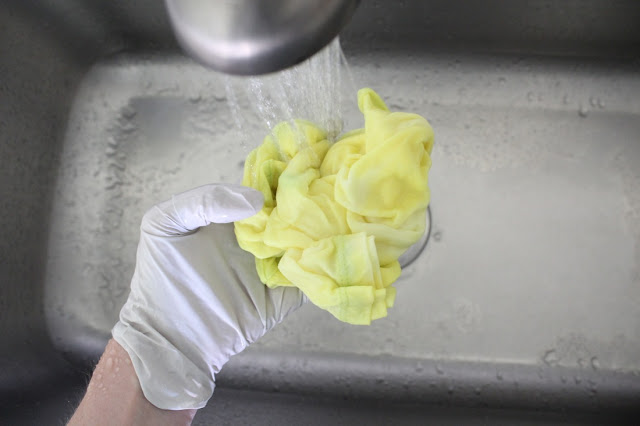
This screenshot has width=640, height=426. I want to click on sink drain, so click(x=417, y=252).